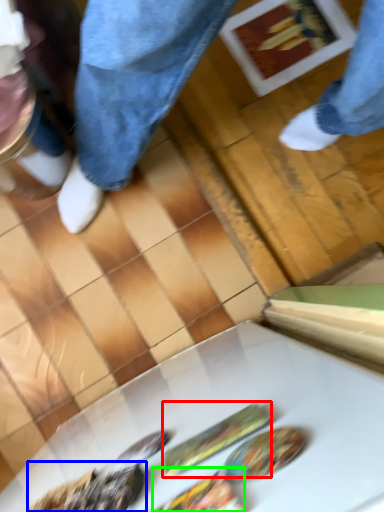
Question: Based on their relative distances, which object is farther from food (highlighted by a red box)? Choose from food (highlighted by a blue box) and food (highlighted by a green box).

Choices:
 (A) food
 (B) food

Answer: (A)